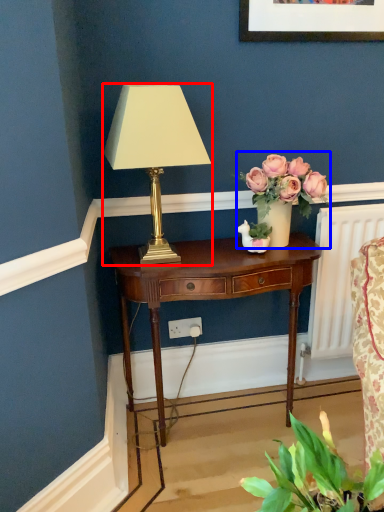
Question: Which of the following is the closest to the observer, lamp (highlighted by a red box) or floral arrangement (highlighted by a blue box)?

Choices:
 (A) lamp
 (B) floral arrangement

Answer: (A)